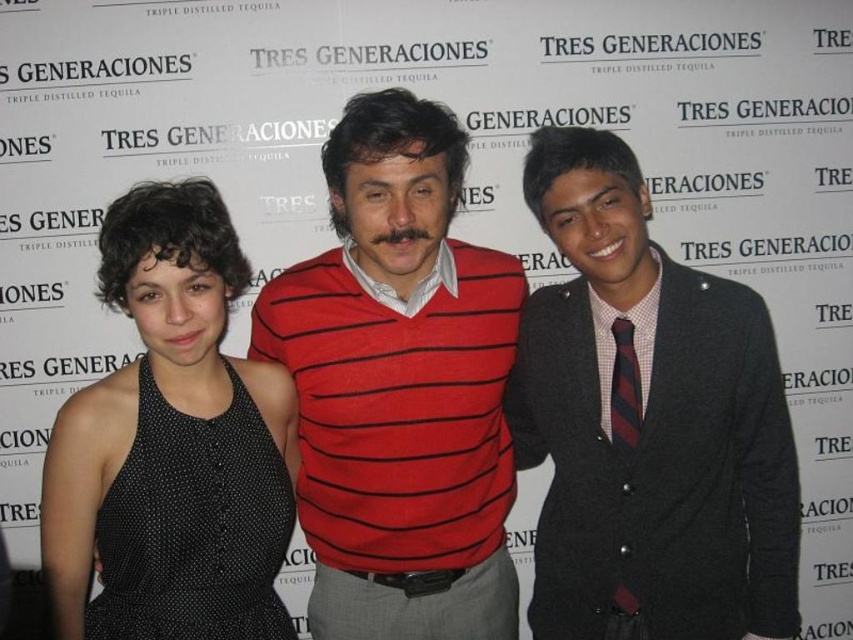
Can you confirm if dark gray wool cardigan at center is thinner than red striped sweater at center?

Correct, dark gray wool cardigan at center's width is less than red striped sweater at center's.

Which is in front, point (682, 388) or point (335, 493)?

Point (682, 388)

The image size is (853, 640). I want to click on dark gray wool cardigan at center, so (648, 419).

Can you confirm if red striped sweater at center is wider than black dotted dress at left?

Correct, the width of red striped sweater at center exceeds that of black dotted dress at left.

Does red striped sweater at center appear on the right side of black dotted dress at left?

Yes, red striped sweater at center is to the right of black dotted dress at left.

Between point (442, 112) and point (62, 552), which one is positioned in front?

Point (62, 552)

Locate an element on the screen. The height and width of the screenshot is (640, 853). red striped sweater at center is located at coordinates (399, 387).

Can you confirm if dark gray wool cardigan at center is positioned above black dotted dress at left?

Yes.

Can you confirm if dark gray wool cardigan at center is bigger than black dotted dress at left?

Yes, dark gray wool cardigan at center is bigger than black dotted dress at left.

At what (x,y) coordinates should I click in order to perform the action: click on dark gray wool cardigan at center. Please return your answer as a coordinate pair (x, y). This screenshot has width=853, height=640. Looking at the image, I should click on (648, 419).